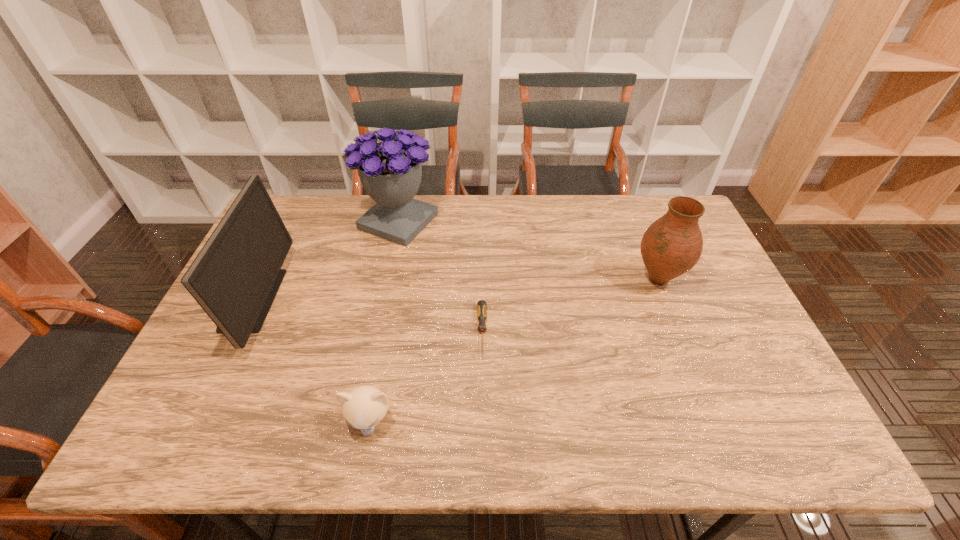
In order to click on bouquet in this screenshot , I will do `click(390, 171)`.

Identify the location of the leftmost object. The image size is (960, 540). (235, 277).

The width and height of the screenshot is (960, 540). In order to click on the rightmost object in this screenshot , I will do `click(672, 245)`.

At what (x,y) coordinates should I click in order to perform the action: click on the second shortest object. Please return your answer as a coordinate pair (x, y). The height and width of the screenshot is (540, 960). Looking at the image, I should click on (364, 407).

Where is `kitten`? kitten is located at coordinates (364, 407).

This screenshot has width=960, height=540. What are the coordinates of `the fourth object from left to right` in the screenshot? It's located at (481, 305).

This screenshot has width=960, height=540. Find the location of `the shortest object`. the shortest object is located at coordinates (481, 305).

The image size is (960, 540). I want to click on free space located 0.220m on the left of the bouquet, so click(295, 221).

Locate an element on the screen. free point located on the screen side of the computer monitor is located at coordinates (354, 300).

Where is `vacant position located on the back of the vase`? The image size is (960, 540). vacant position located on the back of the vase is located at coordinates (629, 206).